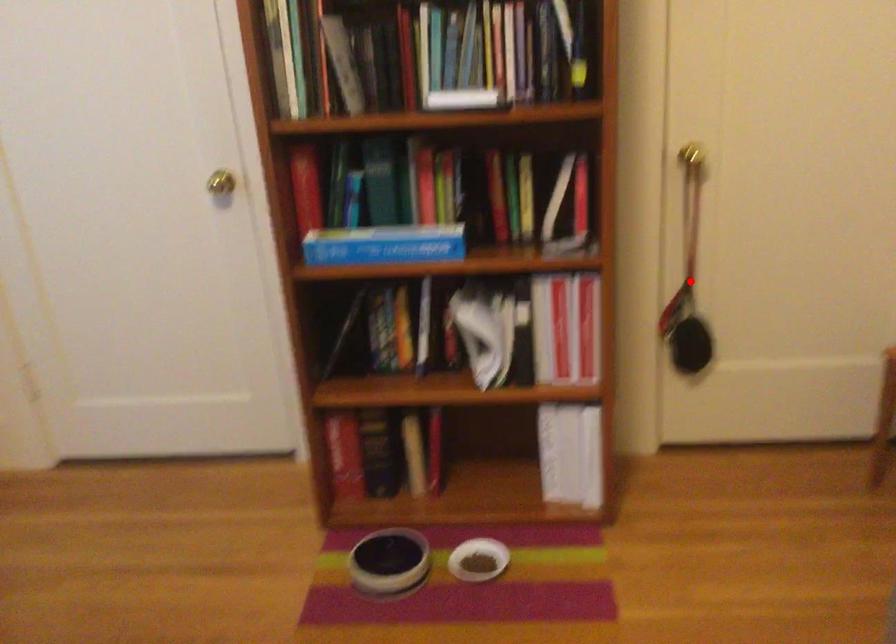
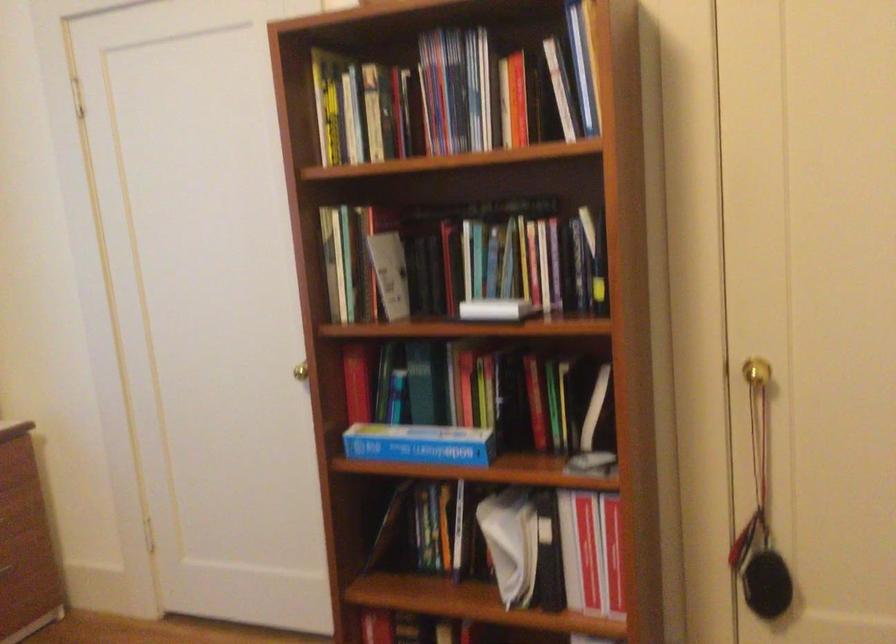
Question: I am providing you with two images of the same scene from different viewpoints. In image1, a red point is highlighted. Considering the same 3D point in image2, which of the following is correct?

Choices:
 (A) It is closer
 (B) It is farther

Answer: (A)